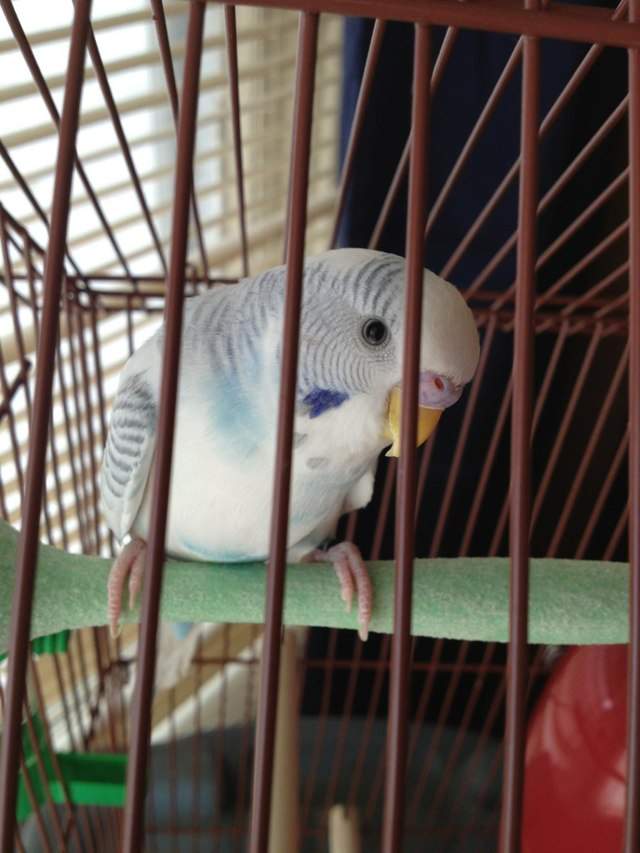
Image resolution: width=640 pixels, height=853 pixels. I want to click on window, so click(106, 164), click(107, 352).